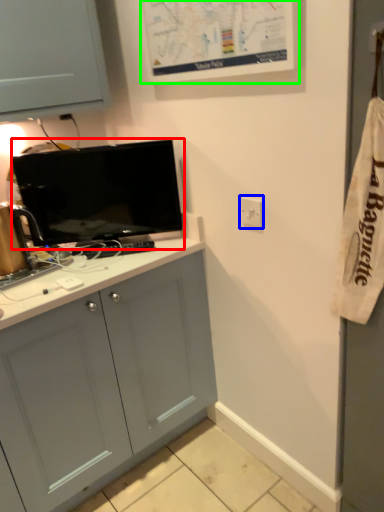
Question: Which object is positioned closest to television (highlighted by a red box)? Select from electric outlet (highlighted by a blue box) and bulletin board (highlighted by a green box).

Choices:
 (A) electric outlet
 (B) bulletin board

Answer: (B)